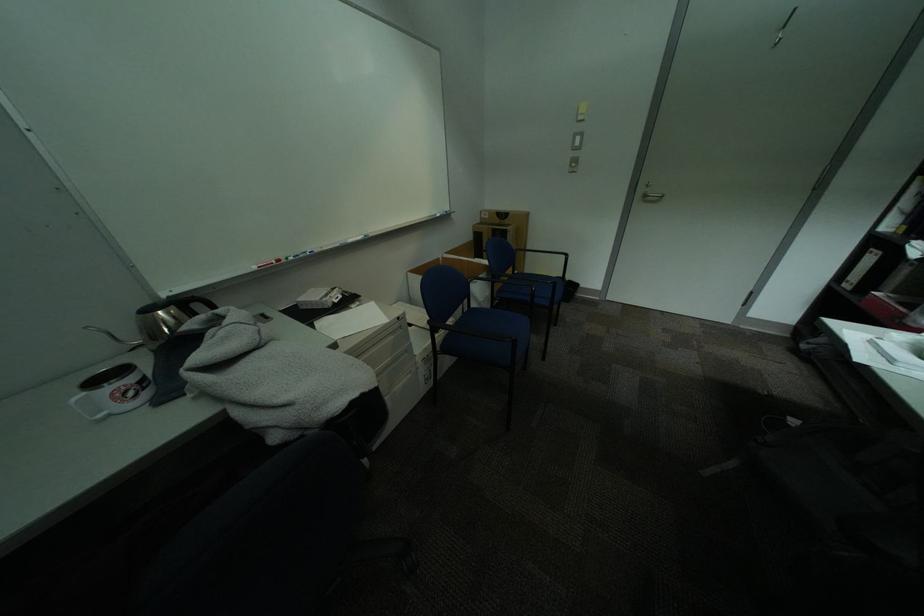
The height and width of the screenshot is (616, 924). I want to click on blue chair sitting surface, so click(x=494, y=323).